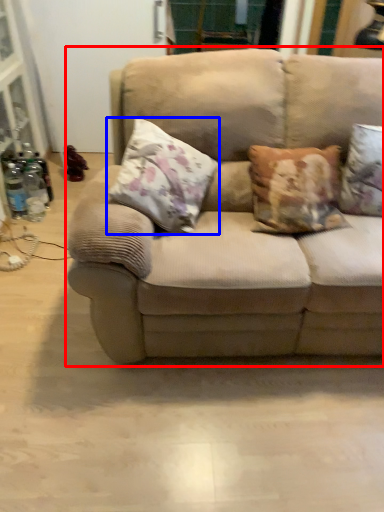
Question: Which object appears closest to the camera in this image, studio couch (highlighted by a red box) or pillow (highlighted by a blue box)?

Choices:
 (A) studio couch
 (B) pillow

Answer: (A)